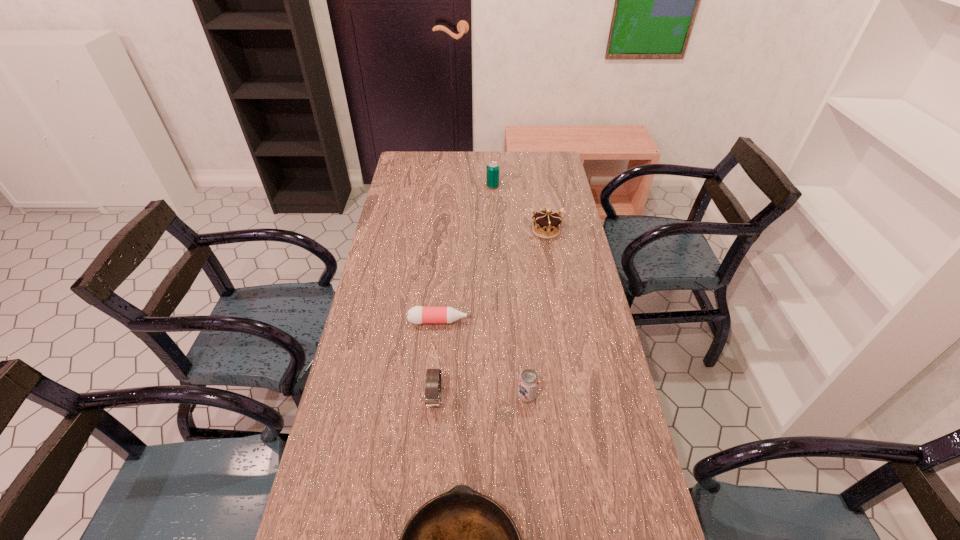
Identify the location of the farther beer can. The image size is (960, 540). (492, 174).

Locate an element on the screen. the left beer can is located at coordinates (492, 174).

Where is `crown`? The image size is (960, 540). crown is located at coordinates (546, 224).

Locate an element on the screen. This screenshot has height=540, width=960. watch is located at coordinates (433, 376).

Find the location of a particular element. The height and width of the screenshot is (540, 960). the shorter beer can is located at coordinates (528, 383).

Where is `the nearer beer can`? The image size is (960, 540). the nearer beer can is located at coordinates (528, 383).

You are a GUI agent. You are given a task and a screenshot of the screen. Output one action in this format:
    pyautogui.click(x=<x>, y=<y>)
    Task: Click on the third farthest object
    
    Given the screenshot: What is the action you would take?
    pyautogui.click(x=418, y=314)

Locate an element on the screen. free region located 0.160m on the right of the farther beer can is located at coordinates (535, 186).

Locate an element on the screen. vacant space located on the front of the crown is located at coordinates (553, 272).

The width and height of the screenshot is (960, 540). In order to click on free location located on the face of the watch in this screenshot , I will do `click(430, 458)`.